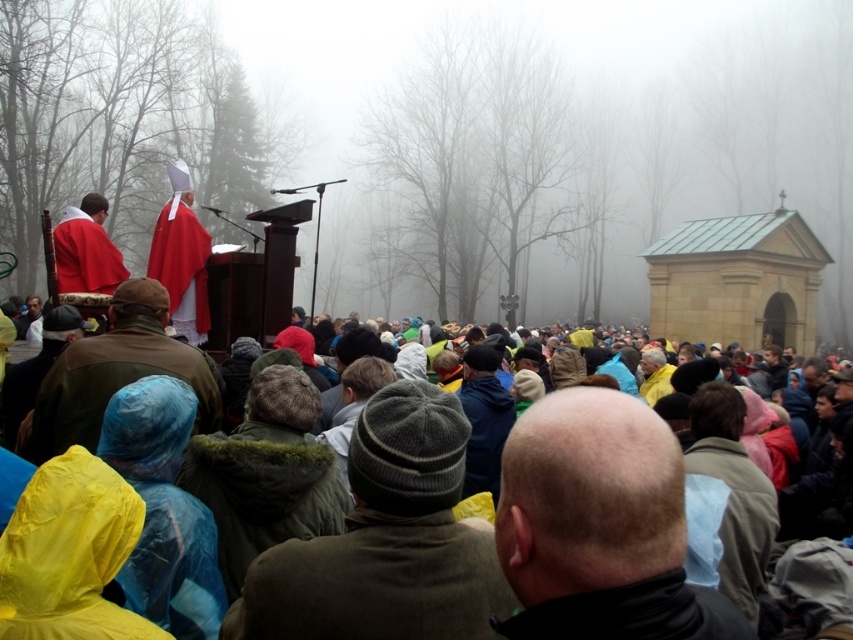
Image resolution: width=853 pixels, height=640 pixels. What do you see at coordinates (662, 515) in the screenshot?
I see `yellow raincoat at center` at bounding box center [662, 515].

Who is positioned more to the right, yellow raincoat at center or matte red robe at center?

yellow raincoat at center is more to the right.

Between point (561, 557) and point (173, 301), which one is positioned behind?

The point (173, 301) is more distant.

You are a GUI agent. You are given a task and a screenshot of the screen. Output one action in this format:
    pyautogui.click(x=<x>, y=<y>)
    Task: Click on the yellow raincoat at center
    
    Given the screenshot: What is the action you would take?
    pyautogui.click(x=662, y=515)

Is brown woolen sweater at center bigger than light blue fabric at center?

Incorrect, brown woolen sweater at center is not larger than light blue fabric at center.

Locate an element on the screen. brown woolen sweater at center is located at coordinates (375, 582).

Between point (506, 593) and point (753, 589), which one is positioned in front?

Point (506, 593) is more forward.

This screenshot has height=640, width=853. In order to click on brown woolen sweater at center in this screenshot , I will do `click(375, 582)`.

Is brown woolen sweater at center in front of yellow raincoat at center?

No, it is behind yellow raincoat at center.

This screenshot has width=853, height=640. I want to click on brown woolen sweater at center, so click(375, 582).